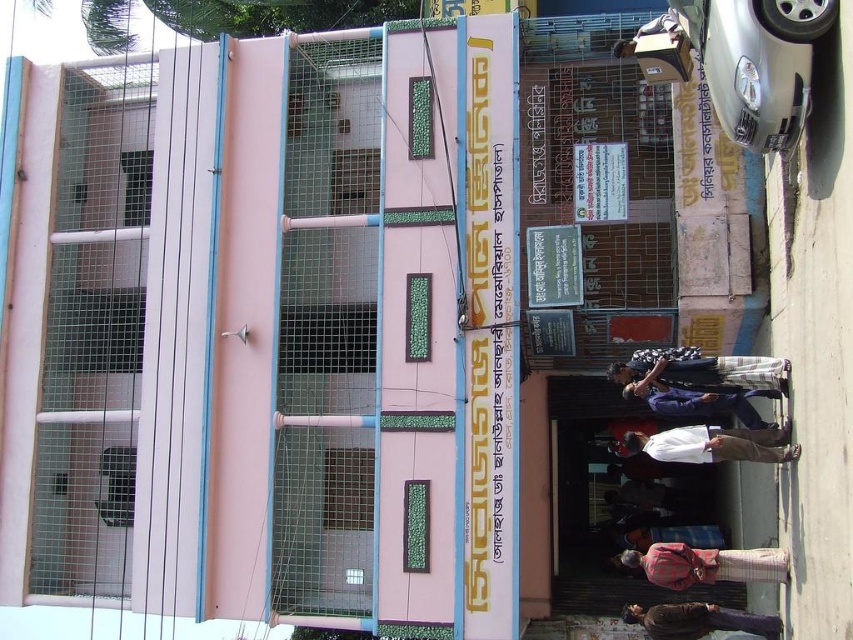
Is red plaid shirt at lower center to the right of brown leather jacket at lower center from the viewer's perspective?

Incorrect, red plaid shirt at lower center is not on the right side of brown leather jacket at lower center.

Between point (664, 570) and point (734, 611), which one is positioned behind?

The point (734, 611) is more distant.

Who is more forward, [685,547] or [689,621]?

Point [689,621] is more forward.

Image resolution: width=853 pixels, height=640 pixels. I want to click on red plaid shirt at lower center, so pyautogui.click(x=706, y=564).

Does silver metallic car at right appear on the left side of dark blue shirt at center?

No, silver metallic car at right is not to the left of dark blue shirt at center.

Can you confirm if silver metallic car at right is taller than dark blue shirt at center?

Correct, silver metallic car at right is much taller as dark blue shirt at center.

Does point (747, 24) come farther from viewer compared to point (659, 403)?

That is False.

This screenshot has width=853, height=640. Find the location of `silver metallic car at right`. silver metallic car at right is located at coordinates (756, 61).

Based on the photo, between silver metallic car at right and brown leather jacket at lower center, which one is positioned higher?

silver metallic car at right is higher up.

Who is more distant from viewer, (709,22) or (744,616)?

The point (744,616) is behind.

Locate an element on the screen. The width and height of the screenshot is (853, 640). silver metallic car at right is located at coordinates (756, 61).

Locate an element on the screen. The image size is (853, 640). silver metallic car at right is located at coordinates (756, 61).